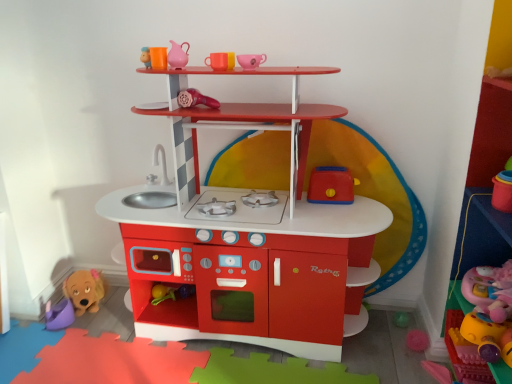
Question: Is soft pink plush at lower right, the eighth toy viewed from the left, positioned in front of purple plastic bucket at lower left, acting as the 8th toy starting from the right?

Choices:
 (A) yes
 (B) no

Answer: (A)

Question: Can you confirm if soft pink plush at lower right, positioned as the first toy in right-to-left order, is thinner than purple plastic bucket at lower left, the 1th toy when ordered from left to right?

Choices:
 (A) no
 (B) yes

Answer: (A)

Question: From a real-world perspective, is soft pink plush at lower right, the eighth toy viewed from the left, located higher than purple plastic bucket at lower left, acting as the 8th toy starting from the right?

Choices:
 (A) yes
 (B) no

Answer: (A)

Question: Does soft pink plush at lower right, positioned as the first toy in right-to-left order, have a larger size compared to purple plastic bucket at lower left, the 1th toy when ordered from left to right?

Choices:
 (A) no
 (B) yes

Answer: (B)

Question: Is soft pink plush at lower right, positioned as the first toy in right-to-left order, smaller than purple plastic bucket at lower left, the 1th toy when ordered from left to right?

Choices:
 (A) yes
 (B) no

Answer: (B)

Question: Is soft pink plush at lower right, positioned as the first toy in right-to-left order, shorter than purple plastic bucket at lower left, the 1th toy when ordered from left to right?

Choices:
 (A) yes
 (B) no

Answer: (B)

Question: Is soft pink plush at lower right, positioned as the first toy in right-to-left order, at the back of matte plastic play kitchen at center, the fifth toy when ordered from left to right?

Choices:
 (A) yes
 (B) no

Answer: (B)

Question: From the image's perspective, would you say matte plastic play kitchen at center, the 4th toy positioned from the right, is shown under soft pink plush at lower right, positioned as the first toy in right-to-left order?

Choices:
 (A) yes
 (B) no

Answer: (B)

Question: Is matte plastic play kitchen at center, the 4th toy positioned from the right, shorter than soft pink plush at lower right, the eighth toy viewed from the left?

Choices:
 (A) no
 (B) yes

Answer: (A)

Question: Could soft pink plush at lower right, the eighth toy viewed from the left, be considered to be inside matte plastic play kitchen at center, the fifth toy when ordered from left to right?

Choices:
 (A) no
 (B) yes

Answer: (A)

Question: Is matte plastic play kitchen at center, the fifth toy when ordered from left to right, touching soft pink plush at lower right, the eighth toy viewed from the left?

Choices:
 (A) yes
 (B) no

Answer: (B)

Question: Is matte plastic play kitchen at center, the fifth toy when ordered from left to right, behind soft pink plush at lower right, the eighth toy viewed from the left?

Choices:
 (A) no
 (B) yes

Answer: (B)

Question: From a real-world perspective, is matte plastic play kitchen at center, the fifth toy when ordered from left to right, physically below purple plastic bucket at lower left, acting as the 8th toy starting from the right?

Choices:
 (A) yes
 (B) no

Answer: (B)